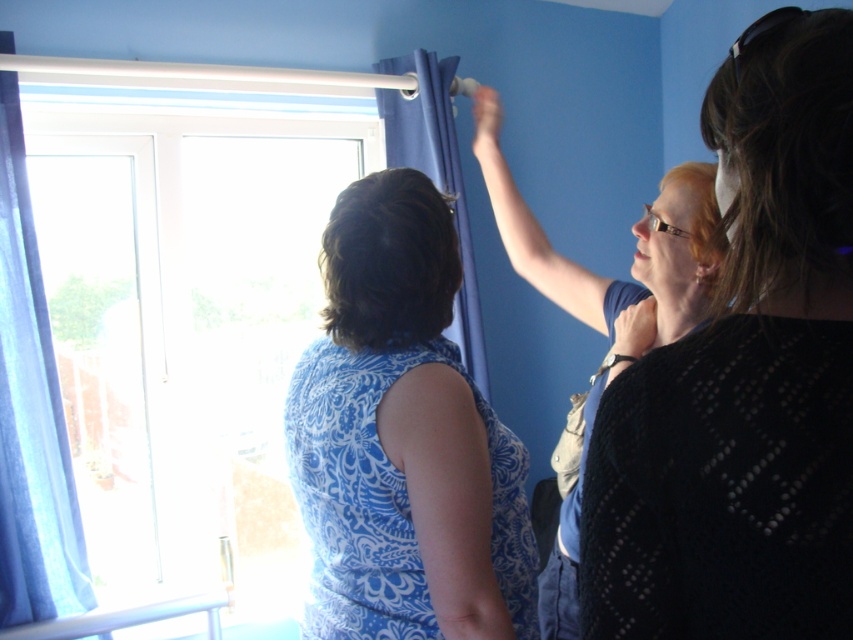
Is matte blue dress at center positioned behind matte blue curtain at upper center?

No, matte blue dress at center is closer to the viewer.

Find the location of `matte blue dress at center`. matte blue dress at center is located at coordinates (744, 380).

Is point (728, 145) farther from camera compared to point (433, 147)?

No.

Find the location of a particular element. matte blue dress at center is located at coordinates (744, 380).

Which is above, matte blue dress at center or matte blue dress at upper center?

Positioned higher is matte blue dress at upper center.

The image size is (853, 640). What do you see at coordinates (744, 380) in the screenshot?
I see `matte blue dress at center` at bounding box center [744, 380].

Find the location of a particular element. The image size is (853, 640). matte blue dress at center is located at coordinates (744, 380).

Which of these two, blue printed dress at center or blue fabric curtain at left, stands taller?

blue fabric curtain at left is taller.

Who is more distant from viewer, [502,572] or [25,481]?

The point [25,481] is more distant.

Between point (434, 566) and point (51, 392), which one is positioned behind?

The point (51, 392) is more distant.

Identify the location of blue printed dress at center. (403, 438).